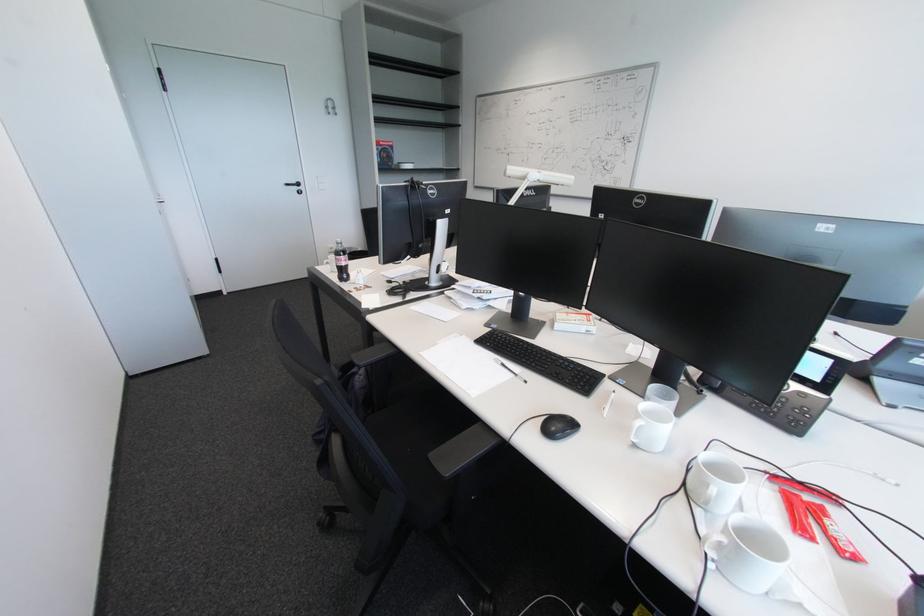
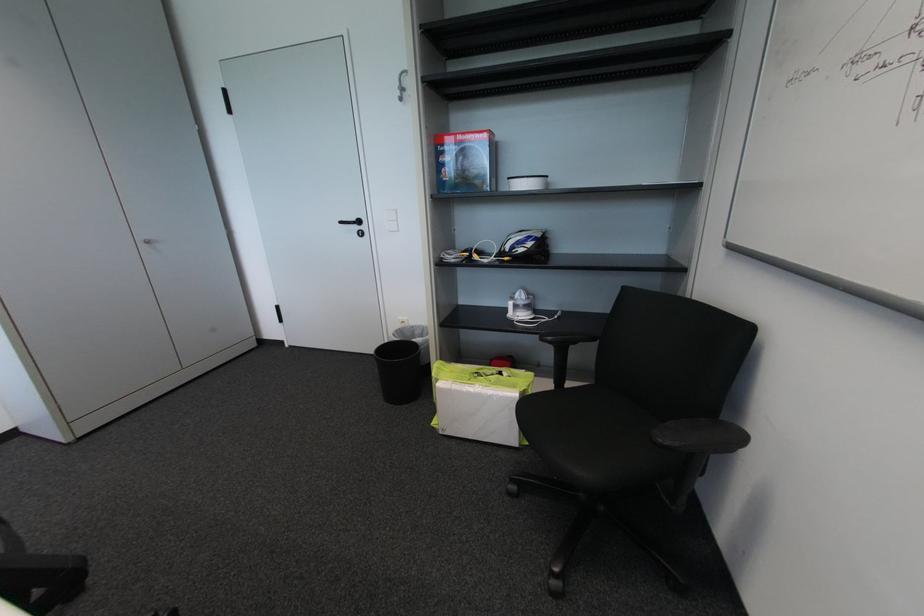
Question: I am providing you with two images of the same scene from different viewpoints. Please identify which objects are invisible in image2.

Choices:
 (A) bicycle helmet
 (B) red cardboard box
 (C) lime green tote bag
 (D) none of these

Answer: (D)